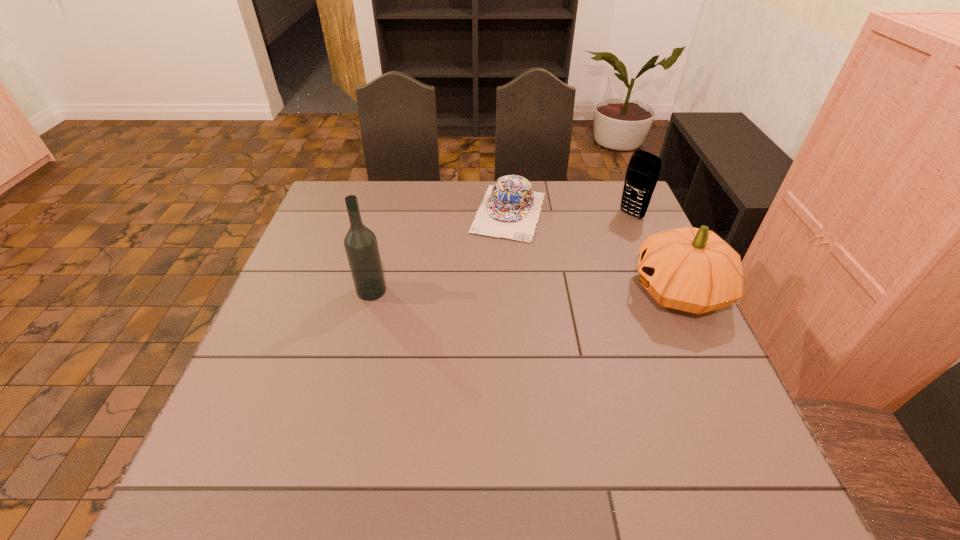
Locate an element on the screen. free space on the desktop that is between the leftmost object and the gourd and is positioned on the screen of the cellular telephone is located at coordinates (521, 291).

I want to click on free spot on the desktop that is between the vodka and the gourd and is positioned on the front, side, and top of the shortest object, so click(x=481, y=291).